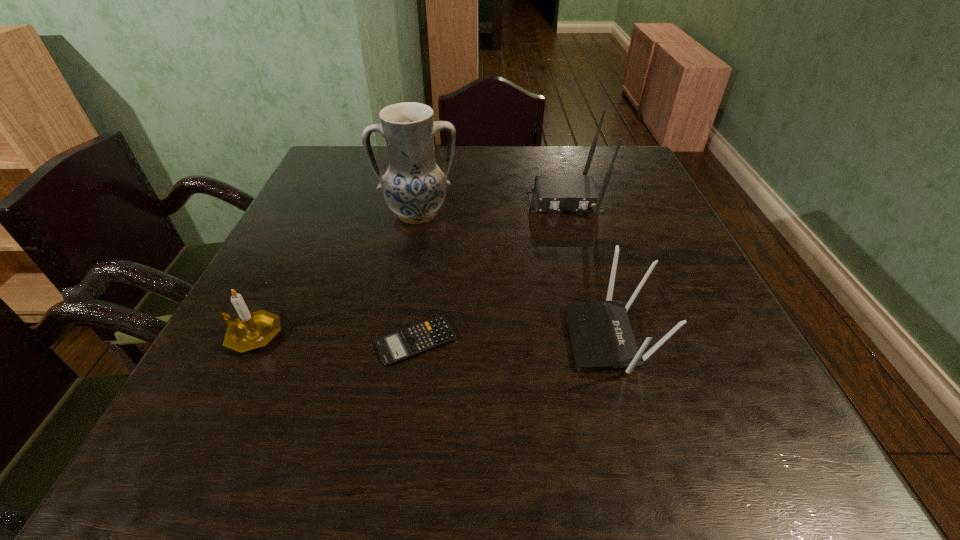
Point out which object is positioned as the fourth nearest to the shorter router. Please provide its 2D coordinates. Your answer should be formatted as a tuple, i.e. [(x, y)], where the tuple contains the x and y coordinates of a point satisfying the conditions above.

[(249, 331)]

Choose which object is the second nearest neighbor to the calculator. Please provide its 2D coordinates. Your answer should be formatted as a tuple, i.e. [(x, y)], where the tuple contains the x and y coordinates of a point satisfying the conditions above.

[(602, 337)]

Locate an element on the screen. The height and width of the screenshot is (540, 960). free region that satisfies the following two spatial constraints: 1. on the back side of the leftmost object; 2. on the right side of the pottery is located at coordinates (312, 214).